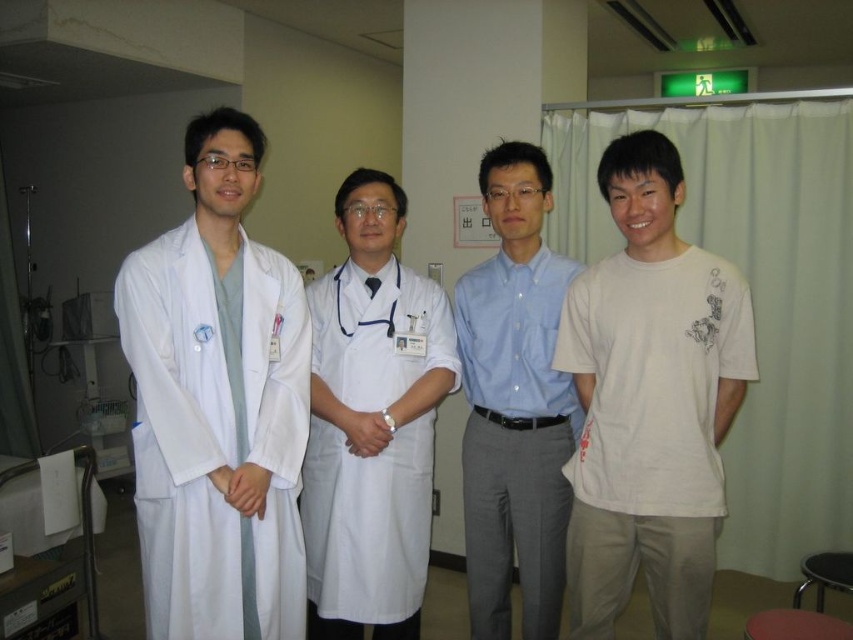
Question: Which object is farther from the camera taking this photo?

Choices:
 (A) white fabric stethoscope at center
 (B) white matte lab coat at center
 (C) white cotton t-shirt at right
 (D) white matte lab coat at left

Answer: (A)

Question: Which point is closer to the camera?

Choices:
 (A) (347, 349)
 (B) (148, 602)
 (C) (468, 289)

Answer: (B)

Question: Which point appears closest to the camera in this image?

Choices:
 (A) (489, 275)
 (B) (708, 378)

Answer: (B)

Question: Does white matte lab coat at left have a greater width compared to light blue button-down shirt at center?

Choices:
 (A) yes
 (B) no

Answer: (A)

Question: Is white cotton t-shirt at right bigger than light blue button-down shirt at center?

Choices:
 (A) yes
 (B) no

Answer: (A)

Question: Is white cotton t-shirt at right positioned before light blue button-down shirt at center?

Choices:
 (A) no
 (B) yes

Answer: (B)